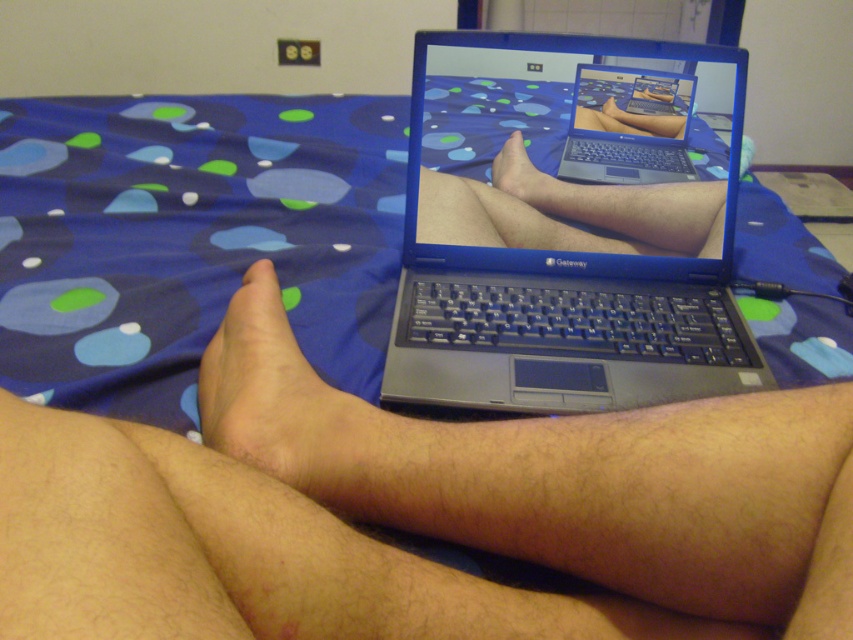
Who is higher up, silver metallic laptop at center or smooth skin foot at center?

Positioned higher is silver metallic laptop at center.

Is silver metallic laptop at center wider than smooth skin foot at center?

Yes, silver metallic laptop at center is wider than smooth skin foot at center.

Who is more distant from viewer, (x=693, y=80) or (x=518, y=138)?

The point (x=518, y=138) is more distant.

The width and height of the screenshot is (853, 640). I want to click on silver metallic laptop at center, so click(628, 125).

Which is above, skinny tan skin at center or silver metallic laptop at center?

Positioned higher is silver metallic laptop at center.

Can you confirm if skinny tan skin at center is positioned to the left of silver metallic laptop at center?

Yes, skinny tan skin at center is to the left of silver metallic laptop at center.

What do you see at coordinates (287, 406) in the screenshot?
I see `skinny tan skin at center` at bounding box center [287, 406].

The image size is (853, 640). I want to click on skinny tan skin at center, so click(287, 406).

What do you see at coordinates (564, 237) in the screenshot? Image resolution: width=853 pixels, height=640 pixels. I see `black plastic laptop at center` at bounding box center [564, 237].

Which is in front, point (585, 257) or point (206, 378)?

Positioned in front is point (206, 378).

Where is `black plastic laptop at center`? black plastic laptop at center is located at coordinates (564, 237).